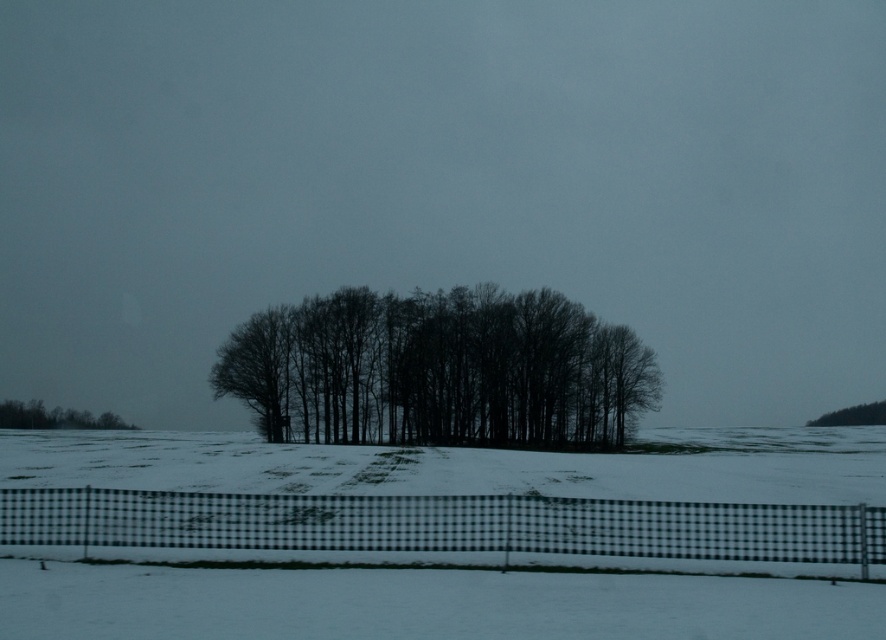
Question: Does green matte trees at lower left have a lesser width compared to smooth brown tree at right?

Choices:
 (A) no
 (B) yes

Answer: (A)

Question: In this image, where is green matte trees at lower left located relative to smooth brown tree at right?

Choices:
 (A) above
 (B) below

Answer: (A)

Question: Considering the real-world distances, which object is closest to the white powdery snow at center?

Choices:
 (A) black checkered fence at lower center
 (B) black matte trees at center
 (C) smooth brown tree at right
 (D) green matte trees at lower left

Answer: (B)

Question: Among these objects, which one is nearest to the camera?

Choices:
 (A) smooth brown tree at right
 (B) black checkered fence at lower center
 (C) green matte trees at lower left
 (D) black matte trees at center

Answer: (B)

Question: Which point is farther to the camera?

Choices:
 (A) (1, 410)
 (B) (813, 458)
 (C) (859, 412)
 (D) (167, 538)

Answer: (C)

Question: In this image, where is white powdery snow at center located relative to green matte trees at lower left?

Choices:
 (A) above
 (B) below

Answer: (A)